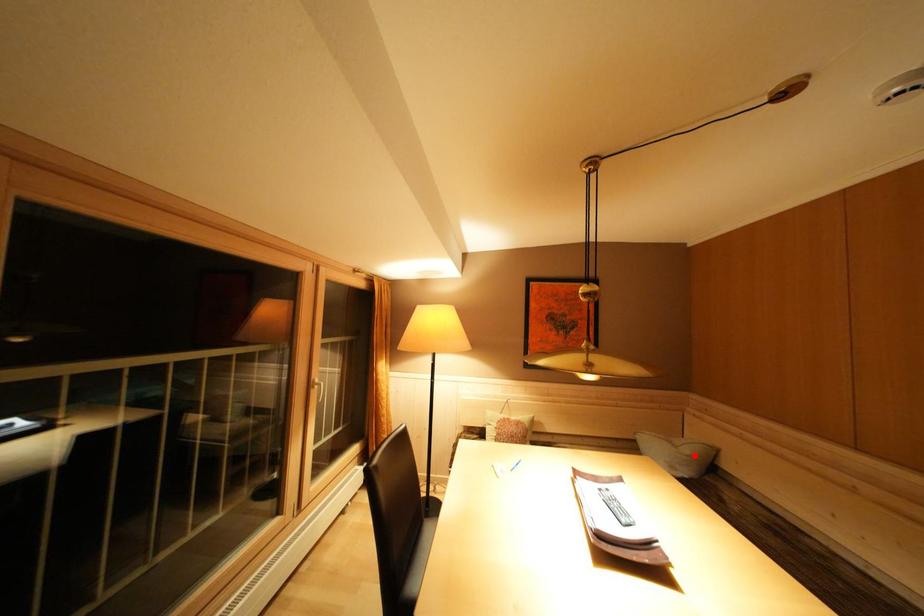
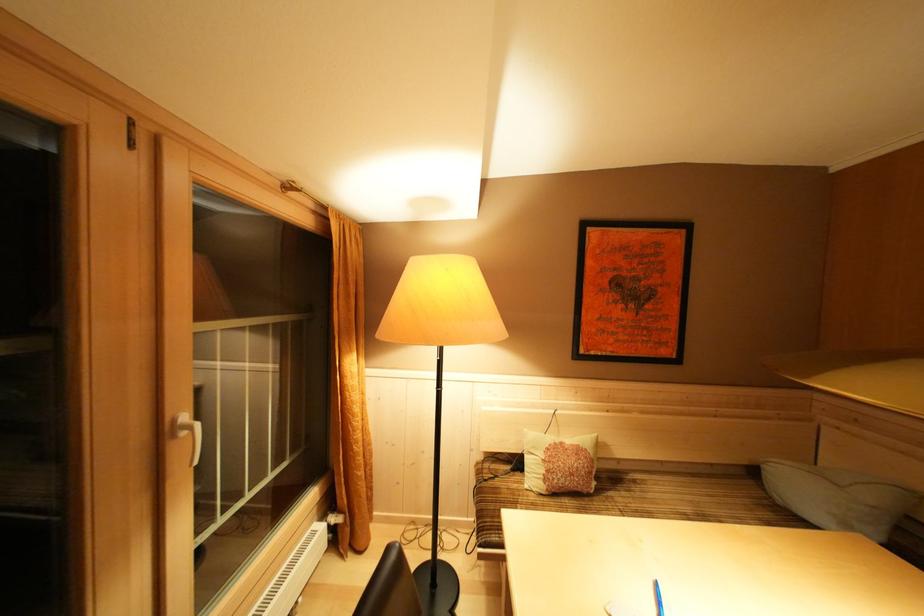
Find the pixel in the second image that matches the highlighted location in the first image.

(879, 503)